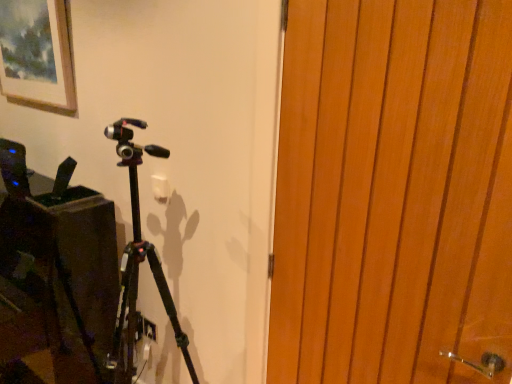
Identify the location of black matte tripod at center. (182, 153).

Measure the distance between point (492, 326) and camera.

Point (492, 326) is 38.23 inches from camera.

I want to click on matte wooden picture frame at upper left, so click(x=36, y=53).

The width and height of the screenshot is (512, 384). In order to click on backdrop on the left side of wooden door at right in this screenshot , I will do `click(182, 153)`.

Is wooden door at right wider or thinner than black matte tripod at center?

Considering their sizes, wooden door at right looks slimmer than black matte tripod at center.

Is wooden door at right in front of or behind black matte tripod at center in the image?

Clearly, wooden door at right is in front of black matte tripod at center.

From a real-world perspective, is matte wooden picture frame at upper left physically below black matte tripod at center?

No, from a real-world perspective, matte wooden picture frame at upper left is not under black matte tripod at center.

Looking at this image, in terms of size, does matte wooden picture frame at upper left appear bigger or smaller than black matte tripod at center?

Considering their sizes, matte wooden picture frame at upper left takes up less space than black matte tripod at center.

Considering the relative sizes of matte wooden picture frame at upper left and black matte tripod at center in the image provided, is matte wooden picture frame at upper left shorter than black matte tripod at center?

Indeed, matte wooden picture frame at upper left has a lesser height compared to black matte tripod at center.

Image resolution: width=512 pixels, height=384 pixels. Find the location of `backdrop that is below the matte wooden picture frame at upper left (from the image's perspective)`. backdrop that is below the matte wooden picture frame at upper left (from the image's perspective) is located at coordinates (182, 153).

Can you confirm if black matte tripod at center is shorter than wooden door at right?

Incorrect, the height of black matte tripod at center does not fall short of that of wooden door at right.

Does black matte tripod at center have a larger size compared to wooden door at right?

Correct, black matte tripod at center is larger in size than wooden door at right.

Does point (275, 57) come closer to viewer compared to point (442, 245)?

No, (275, 57) is behind (442, 245).

Does wooden door at right have a lesser width compared to matte wooden picture frame at upper left?

Correct, the width of wooden door at right is less than that of matte wooden picture frame at upper left.

Between wooden door at right and matte wooden picture frame at upper left, which one has larger size?

wooden door at right.

Are wooden door at right and matte wooden picture frame at upper left making contact?

No, wooden door at right is not next to matte wooden picture frame at upper left.

Find the location of `door lying on the right of matte wooden picture frame at upper left`. door lying on the right of matte wooden picture frame at upper left is located at coordinates (393, 192).

You are a GUI agent. You are given a task and a screenshot of the screen. Output one action in this format:
    pyautogui.click(x=<x>, y=<y>)
    Task: Click on the door on the right of matte wooden picture frame at upper left
    Image resolution: width=512 pixels, height=384 pixels.
    Given the screenshot: What is the action you would take?
    pyautogui.click(x=393, y=192)

Is matte wooden picture frame at upper left facing towards wooden door at right?

No, matte wooden picture frame at upper left is not aimed at wooden door at right.

Considering the relative sizes of matte wooden picture frame at upper left and wooden door at right in the image provided, is matte wooden picture frame at upper left taller than wooden door at right?

No.

Based on the photo, from a real-world perspective, does matte wooden picture frame at upper left stand above wooden door at right?

Yes, from a real-world perspective, matte wooden picture frame at upper left is over wooden door at right

Is black matte tripod at center oriented away from matte wooden picture frame at upper left?

No, matte wooden picture frame at upper left is not at the back of black matte tripod at center.

Considering the positions of objects black matte tripod at center and matte wooden picture frame at upper left in the image provided, who is more to the right, black matte tripod at center or matte wooden picture frame at upper left?

Positioned to the right is black matte tripod at center.

From the image's perspective, is black matte tripod at center located beneath matte wooden picture frame at upper left?

Yes.

Considering the sizes of black matte tripod at center and matte wooden picture frame at upper left in the image, is black matte tripod at center taller or shorter than matte wooden picture frame at upper left?

Considering their sizes, black matte tripod at center has more height than matte wooden picture frame at upper left.

Identify the location of door that appears above the black matte tripod at center (from the image's perspective). (393, 192).

Where is `picture frame on the left of black matte tripod at center`? Image resolution: width=512 pixels, height=384 pixels. picture frame on the left of black matte tripod at center is located at coordinates (36, 53).

Estimate the real-world distances between objects in this image. Which object is closer to matte wooden picture frame at upper left, wooden door at right or black matte tripod at center?

Based on the image, black matte tripod at center appears to be nearer to matte wooden picture frame at upper left.

Considering their positions, is matte wooden picture frame at upper left positioned closer to black matte tripod at center than wooden door at right?

wooden door at right is closer to black matte tripod at center.

When comparing their distances from matte wooden picture frame at upper left, does black matte tripod at center or wooden door at right seem further?

wooden door at right is positioned further to the anchor matte wooden picture frame at upper left.

Which object lies further to the anchor point black matte tripod at center, wooden door at right or matte wooden picture frame at upper left?

matte wooden picture frame at upper left.

Considering their positions, is matte wooden picture frame at upper left positioned closer to wooden door at right than black matte tripod at center?

black matte tripod at center lies closer to wooden door at right than the other object.

Estimate the real-world distances between objects in this image. Which object is further from wooden door at right, black matte tripod at center or matte wooden picture frame at upper left?

matte wooden picture frame at upper left is further to wooden door at right.

Where is `backdrop between matte wooden picture frame at upper left and wooden door at right`? This screenshot has height=384, width=512. backdrop between matte wooden picture frame at upper left and wooden door at right is located at coordinates (182, 153).